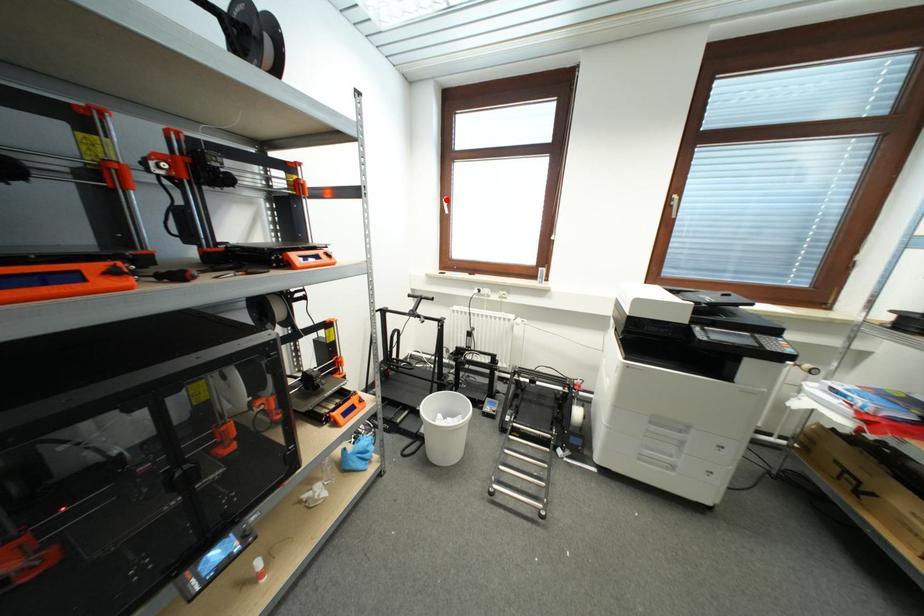
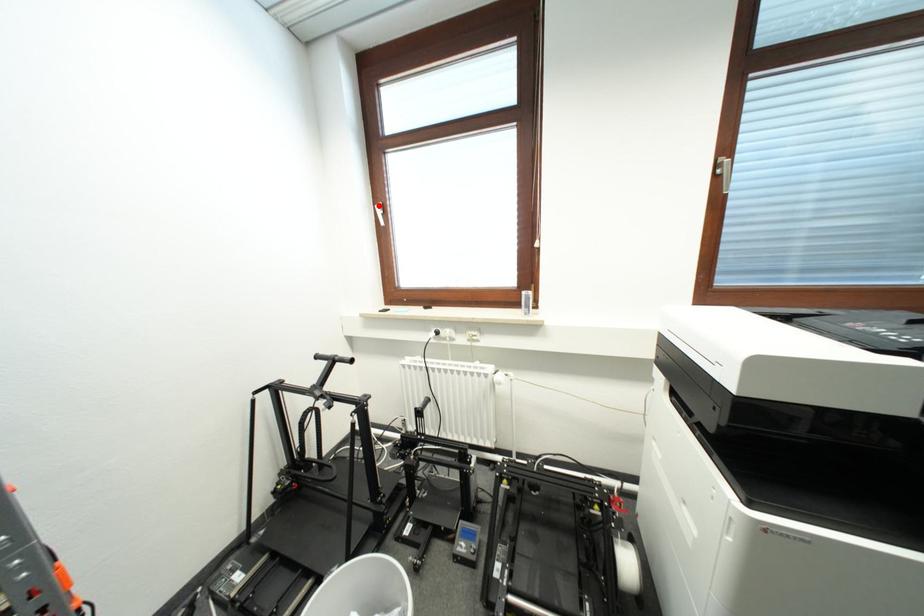
I am providing you with two images of the same scene from different viewpoints. A red point is marked on the first image and another point is marked on the second image. Are the points marked in image1 and image2 representing the same 3D position?

Yes